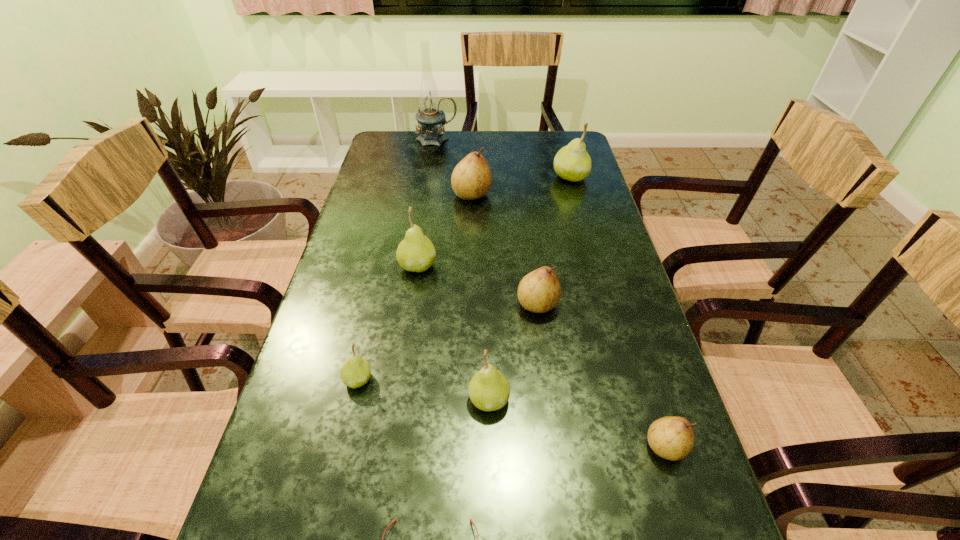
Locate an element on the screen. brown pear that is the nearest to the nearest object is located at coordinates (671, 437).

Identify which brown pear is located as the nearest to the rightmost brown pear. Please provide its 2D coordinates. Your answer should be formatted as a tuple, i.e. [(x, y)], where the tuple contains the x and y coordinates of a point satisfying the conditions above.

[(539, 291)]